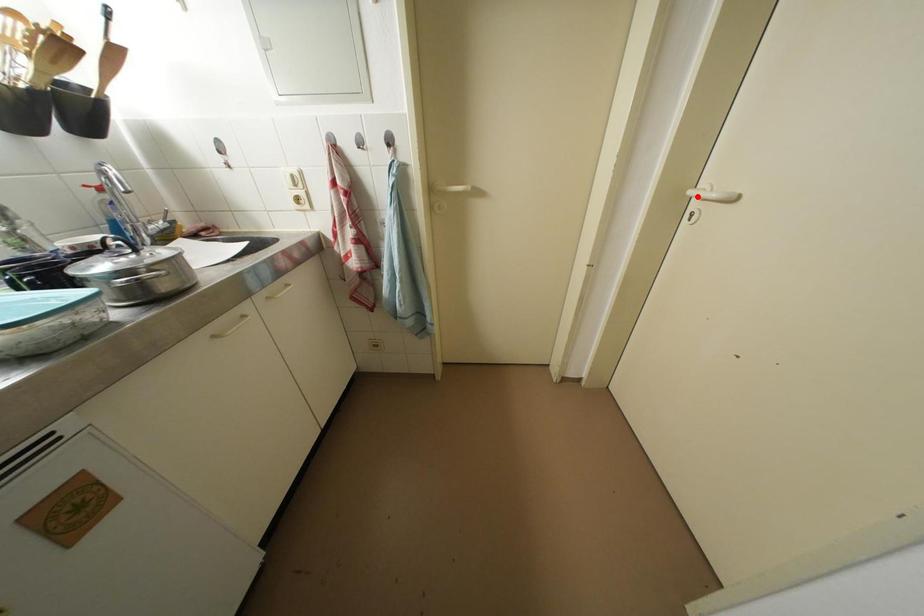
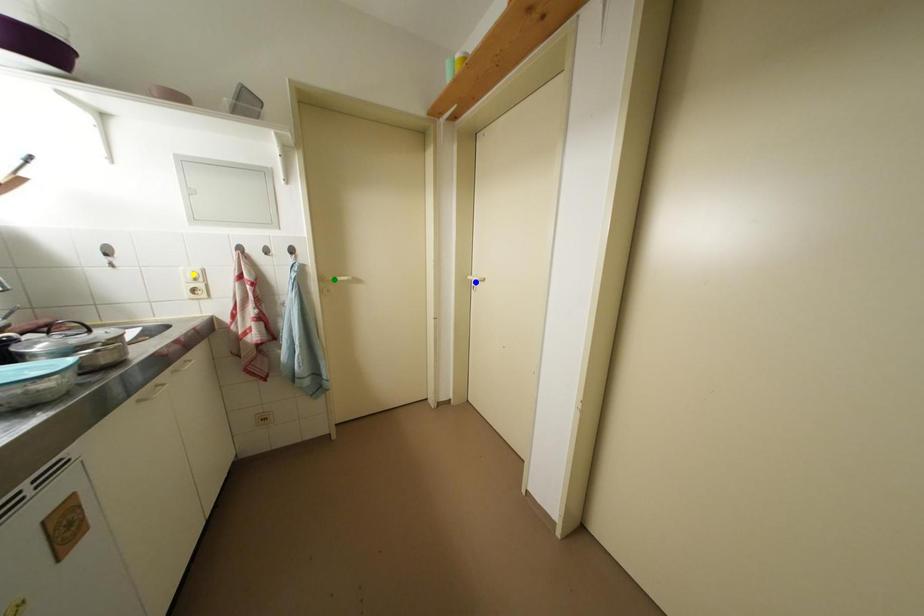
Question: I am providing you with two images of the same scene from different viewpoints. A red point is marked on the first image. You are given multiple points on the second image. In image 2, which mark is for the same physical point as the one in image 1?

Choices:
 (A) blue point
 (B) green point
 (C) yellow point

Answer: (A)